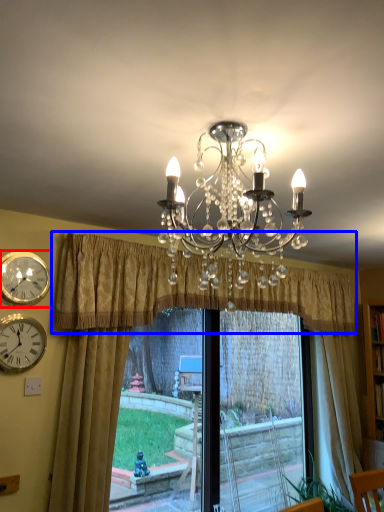
Question: Which point is further to the camera, wall clock (highlighted by a red box) or curtain (highlighted by a blue box)?

Choices:
 (A) wall clock
 (B) curtain

Answer: (A)